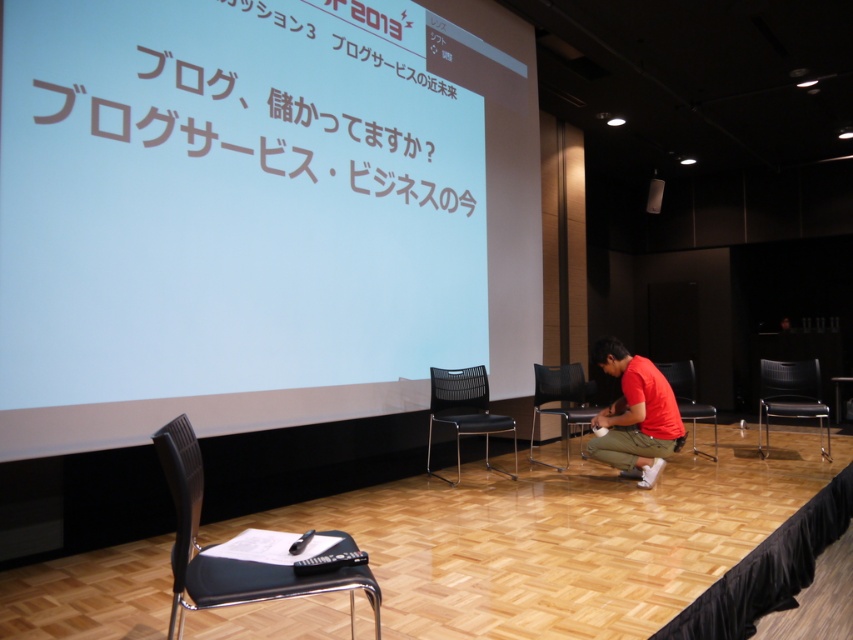
You are an attendee in the conference room. You notice the white matte projection screen at upper center and the white text on screen at center. Which object is closer to you?

The white matte projection screen at upper center is closer to you because it is in front of the white text on screen at center.

You are an attendee in the conference room and want to read the white text on screen at center. Considering the white matte projection screen at upper center, is the screen large enough to display the text clearly?

The white matte projection screen at upper center has a larger size compared to white text on screen at center, so yes, the screen is large enough to display the text clearly.

You are organizing a small meeting in the conference room and need to seat two people. You have a black plastic chair at lower left and a black leather chair at center. Which chair is narrower and better suited for tight spaces?

The black plastic chair at lower left is narrower than the black leather chair at center, making it better suited for tight spaces.